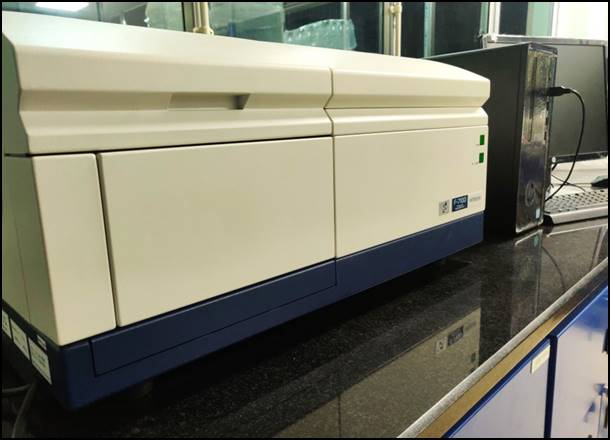
I want to click on drawer, so click(x=218, y=209).